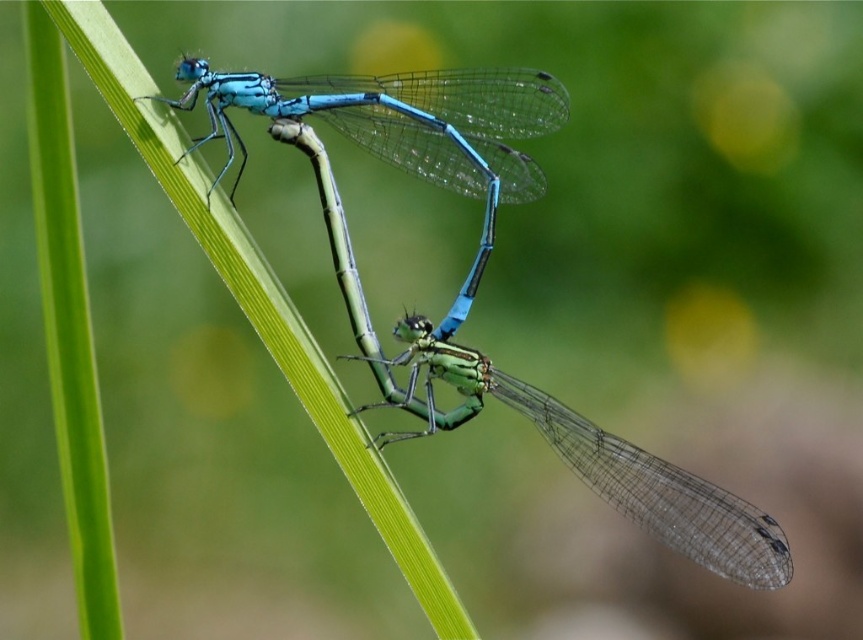
You are a nature photographer aiming to capture the damselflies in their natural position. You need to adjust your camera focus to ensure both the translucent glass dragonfly at center and the matte blue dragonfly at upper center are in sharp focus. Given their positions, which damselfly should you focus on to ensure both are in focus?

You should focus on the translucent glass dragonfly at center because it has a greater height compared to the matte blue dragonfly at upper center, so focusing on the closer one will ensure both are in focus.

You are holding a magnifying glass and examining the scene. You notice a translucent glass dragonfly at center. Where exactly is it located in terms of coordinates?

The translucent glass dragonfly at center is located at coordinates point (550, 422).

You are an entomologist observing two dragonflies in a mating ritual. You notice a translucent glass dragonfly at center and a matte blue dragonfly at upper center. Which dragonfly is closer to you?

The translucent glass dragonfly at center is closer to you because the matte blue dragonfly at upper center is behind it.